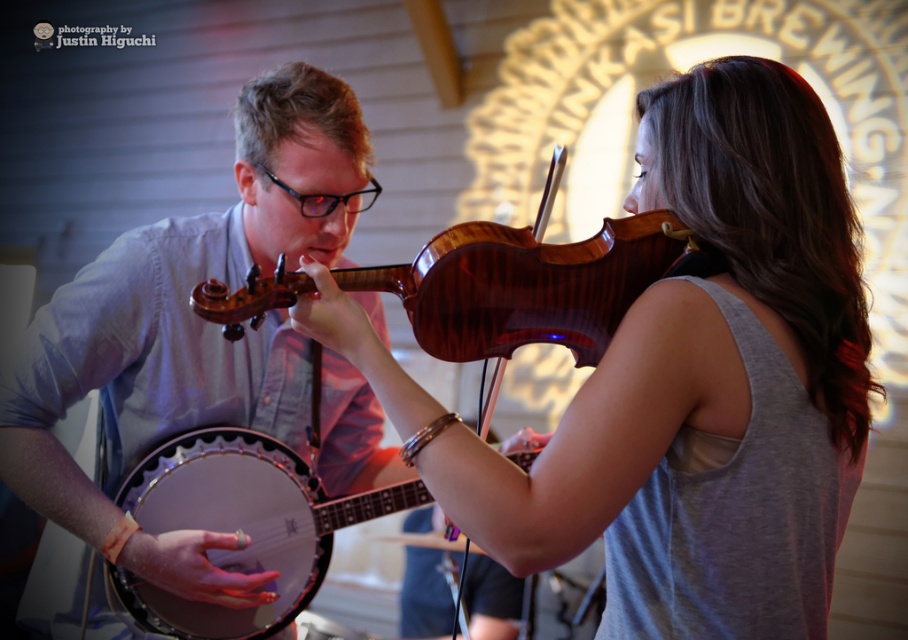
Question: Is wooden violin at center below matte blue shirt at left?

Choices:
 (A) yes
 (B) no

Answer: (B)

Question: Which point is closer to the camera?

Choices:
 (A) matte brown banjo at center
 (B) matte blue shirt at left

Answer: (B)

Question: Can you confirm if wooden violin at center is positioned to the left of matte blue shirt at left?

Choices:
 (A) no
 (B) yes

Answer: (A)

Question: Does matte blue shirt at left have a smaller size compared to matte brown banjo at center?

Choices:
 (A) yes
 (B) no

Answer: (B)

Question: Which object is positioned farthest from the matte brown banjo at center?

Choices:
 (A) matte blue shirt at left
 (B) wooden violin at center

Answer: (B)

Question: Which object appears farthest from the camera in this image?

Choices:
 (A) matte blue shirt at left
 (B) matte brown banjo at center
 (C) wooden violin at center

Answer: (B)